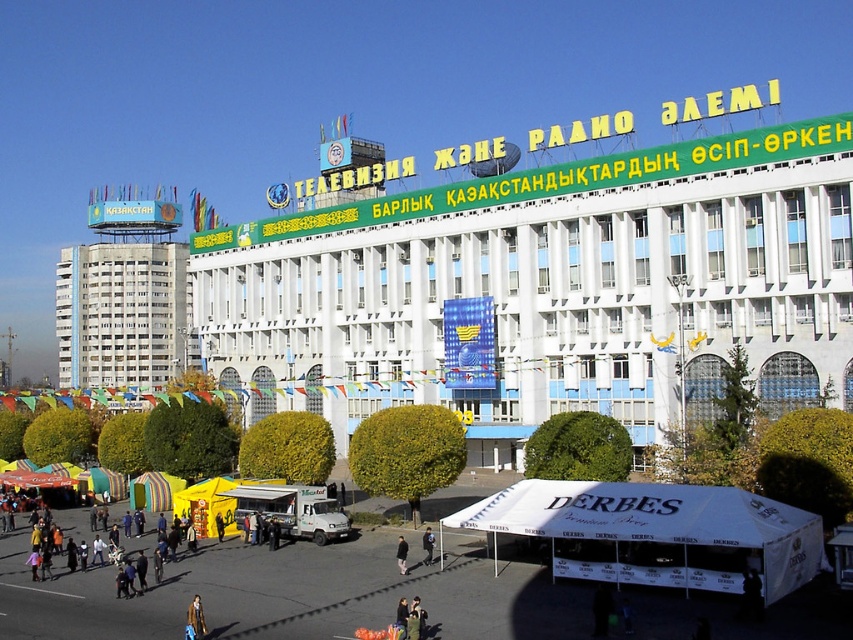
You are standing in the bustling urban scene described. You want to locate the white glossy building at center. Which coordinate point should you look at?

You should look at the coordinate point at (548, 289) to find the white glossy building at center.

You are a visitor at the event and want to take a photo of the building with the striped fabric canopy at center and the black fabric umbrella at center in the foreground. Which object should you position closer to the camera to ensure both are in focus?

To ensure both the striped fabric canopy at center and the black fabric umbrella at center are in focus, position the striped fabric canopy at center closer to the camera since it is already further away than the black fabric umbrella at center.

You are a photographer trying to capture a clear shot of both the white fabric canopy at lower center and the blue denim jacket at lower center. Given their sizes, which object should you focus on first to ensure it fits in the frame?

The white fabric canopy at lower center is bigger than the blue denim jacket at lower center, so you should focus on capturing the white fabric canopy at lower center first to ensure it fits in the frame.